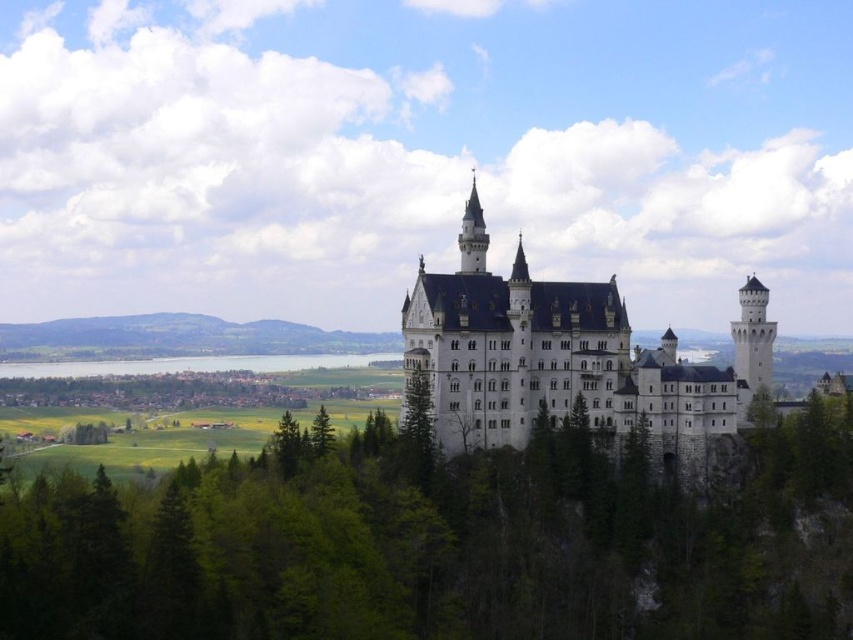
You are standing at the base of Neuschwanstein Castle and want to take a photo of the point at coordinates (x=581, y=480). If your camera has a maximum zoom range of 100 meters, will you be able to capture that point clearly in your photo?

The point at coordinates (x=581, y=480) is 121.19 meters away from the camera. Since the camera can only zoom up to 100 meters, it won not be able to capture the point clearly.

You are a tourist standing at the base of Neuschwanstein Castle. You notice the green leafy trees at center and the white stone castle at center. Which object is positioned higher in the scene?

The white stone castle at center is positioned higher than the green leafy trees at center because the green leafy trees at center are located below it.